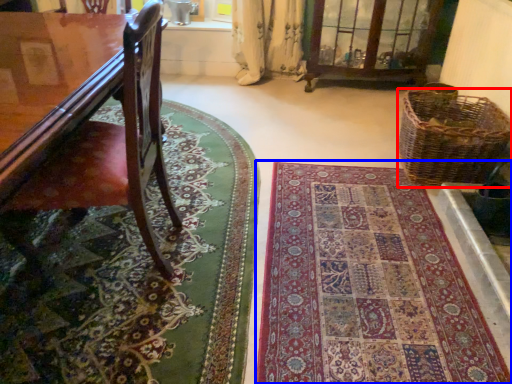
Question: Which object is further to the camera taking this photo, picnic basket (highlighted by a red box) or mat (highlighted by a blue box)?

Choices:
 (A) picnic basket
 (B) mat

Answer: (A)